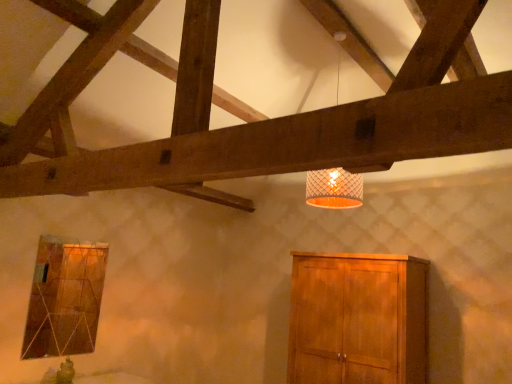
Question: Is matte glass window at lower left positioned with its back to wooden cabinet at lower right?

Choices:
 (A) yes
 (B) no

Answer: (B)

Question: Could you tell me if matte glass window at lower left is turned towards wooden cabinet at lower right?

Choices:
 (A) yes
 (B) no

Answer: (B)

Question: Considering the relative sizes of matte glass window at lower left and wooden cabinet at lower right in the image provided, is matte glass window at lower left bigger than wooden cabinet at lower right?

Choices:
 (A) no
 (B) yes

Answer: (A)

Question: Considering the relative positions of matte glass window at lower left and wooden cabinet at lower right in the image provided, is matte glass window at lower left behind wooden cabinet at lower right?

Choices:
 (A) yes
 (B) no

Answer: (A)

Question: Can you confirm if matte glass window at lower left is wider than wooden cabinet at lower right?

Choices:
 (A) no
 (B) yes

Answer: (A)

Question: From the image's perspective, is matte glass window at lower left positioned above or below wooden cabinet at lower right?

Choices:
 (A) above
 (B) below

Answer: (A)

Question: Is matte glass window at lower left in front of or behind wooden cabinet at lower right in the image?

Choices:
 (A) behind
 (B) front

Answer: (A)

Question: Is point (55, 297) closer or farther from the camera than point (384, 350)?

Choices:
 (A) closer
 (B) farther

Answer: (B)

Question: Is matte glass window at lower left bigger or smaller than wooden cabinet at lower right?

Choices:
 (A) big
 (B) small

Answer: (B)

Question: Is white mesh lampshade at upper center inside the boundaries of matte glass window at lower left, or outside?

Choices:
 (A) inside
 (B) outside

Answer: (B)

Question: Considering the positions of white mesh lampshade at upper center and matte glass window at lower left in the image, is white mesh lampshade at upper center taller or shorter than matte glass window at lower left?

Choices:
 (A) tall
 (B) short

Answer: (A)

Question: Considering the positions of white mesh lampshade at upper center and matte glass window at lower left in the image, is white mesh lampshade at upper center wider or thinner than matte glass window at lower left?

Choices:
 (A) thin
 (B) wide

Answer: (B)

Question: In terms of size, does white mesh lampshade at upper center appear bigger or smaller than matte glass window at lower left?

Choices:
 (A) big
 (B) small

Answer: (A)

Question: Considering the positions of wooden cabinet at lower right and white mesh lampshade at upper center in the image, is wooden cabinet at lower right wider or thinner than white mesh lampshade at upper center?

Choices:
 (A) wide
 (B) thin

Answer: (A)

Question: Is wooden cabinet at lower right taller or shorter than white mesh lampshade at upper center?

Choices:
 (A) tall
 (B) short

Answer: (B)